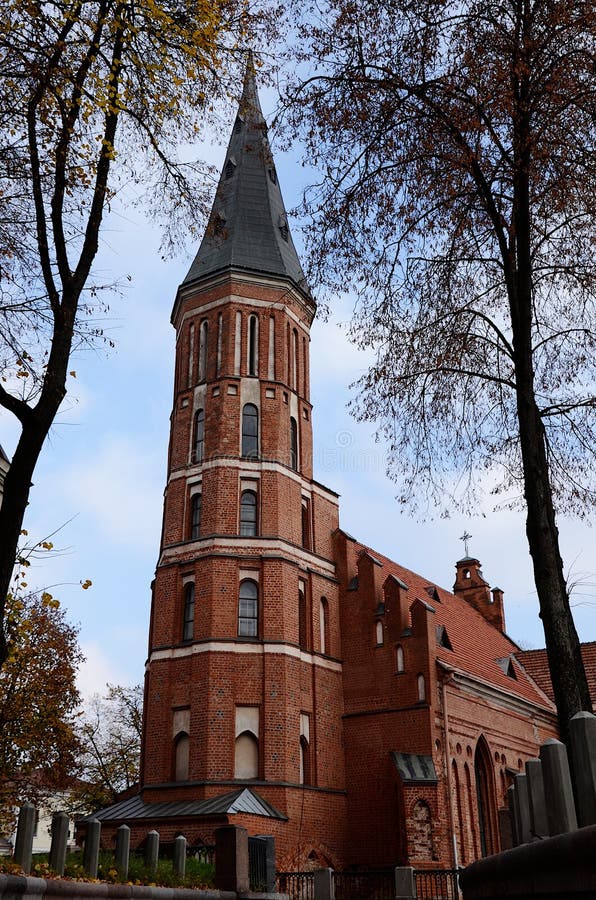
Identify the location of windows with visible glass. (200, 433), (250, 428), (294, 436), (250, 510), (193, 518), (187, 616), (249, 609).